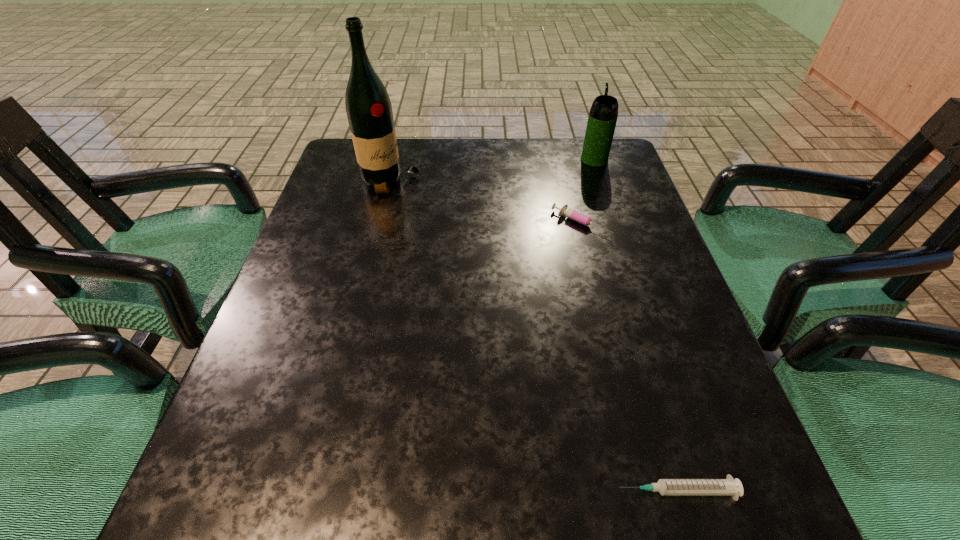
The width and height of the screenshot is (960, 540). Find the location of `empty location between the nearest object and the farther syringe`. empty location between the nearest object and the farther syringe is located at coordinates (629, 357).

At what (x,y) coordinates should I click in order to perform the action: click on free space between the third shortest object and the wine bottle. Please return your answer as a coordinate pair (x, y). Image resolution: width=960 pixels, height=540 pixels. Looking at the image, I should click on (492, 171).

Identify which object is the third closest to the nearest object. Please provide its 2D coordinates. Your answer should be formatted as a tuple, i.e. [(x, y)], where the tuple contains the x and y coordinates of a point satisfying the conditions above.

[(603, 114)]

Locate an element on the screen. This screenshot has width=960, height=540. object that stands as the second closest to the leftmost object is located at coordinates (603, 114).